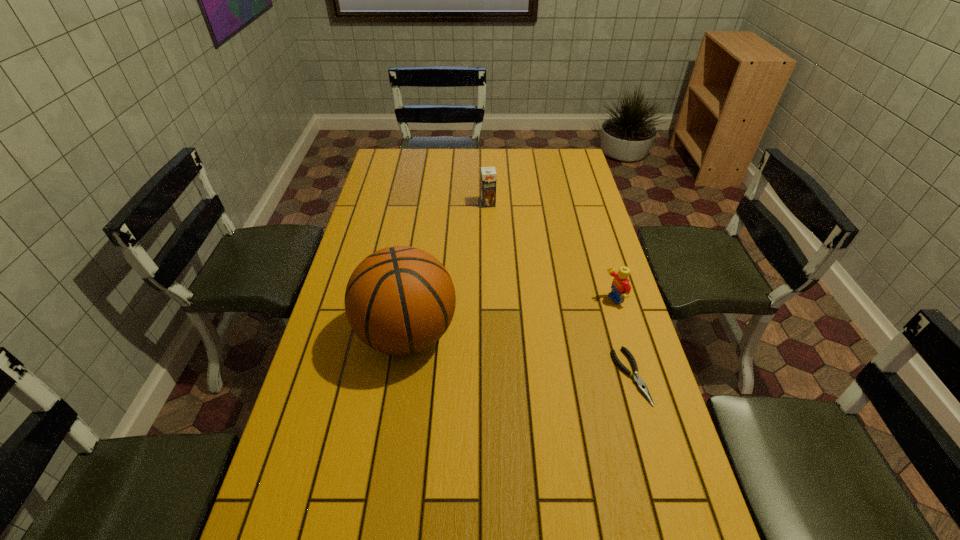
You are a GUI agent. You are given a task and a screenshot of the screen. Output one action in this format:
    pyautogui.click(x=<x>, y=<y>)
    Task: Click on the tallest object
    The height and width of the screenshot is (540, 960).
    Given the screenshot: What is the action you would take?
    pyautogui.click(x=400, y=300)

Where is `basketball`? This screenshot has height=540, width=960. basketball is located at coordinates (400, 300).

Identify the location of the shortest object. (642, 387).

At what (x,y) coordinates should I click in order to perform the action: click on the second shortest object. Please return your answer as a coordinate pair (x, y). Looking at the image, I should click on (621, 288).

Find the location of a particular element. chocolate milk is located at coordinates point(488,174).

In order to click on the second tallest object in this screenshot , I will do `click(488, 174)`.

At what (x,y) coordinates should I click in order to perform the action: click on vacant space positioned 0.070m on the right of the leftmost object. Please return your answer as a coordinate pair (x, y). This screenshot has width=960, height=540. Looking at the image, I should click on (482, 334).

Where is `vacant point located on the left of the shortest object`? vacant point located on the left of the shortest object is located at coordinates (579, 376).

Locate an element on the screen. This screenshot has width=960, height=540. vacant space situated 0.170m on the face of the second shortest object is located at coordinates (555, 321).

At what (x,y) coordinates should I click in order to perform the action: click on free space located on the face of the second shortest object. Please return your answer as a coordinate pair (x, y). The image size is (960, 540). Looking at the image, I should click on (522, 333).